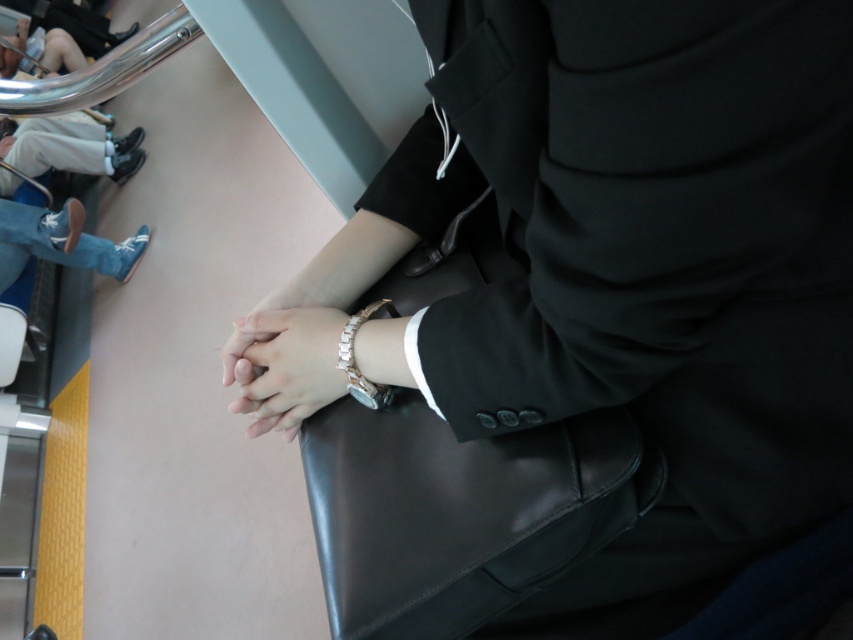
Question: Can you confirm if black matte suit at center is positioned below satin silver watch at center?

Choices:
 (A) no
 (B) yes

Answer: (B)

Question: Among these points, which one is nearest to the camera?

Choices:
 (A) (247, 406)
 (B) (451, 204)

Answer: (A)

Question: Considering the relative positions of black matte suit at center and satin silver watch at center in the image provided, where is black matte suit at center located with respect to satin silver watch at center?

Choices:
 (A) above
 (B) below

Answer: (B)

Question: Which point appears farthest from the camera in this image?

Choices:
 (A) (292, 323)
 (B) (498, 317)

Answer: (A)

Question: Is the position of black matte suit at center less distant than that of satin silver watch at center?

Choices:
 (A) yes
 (B) no

Answer: (A)